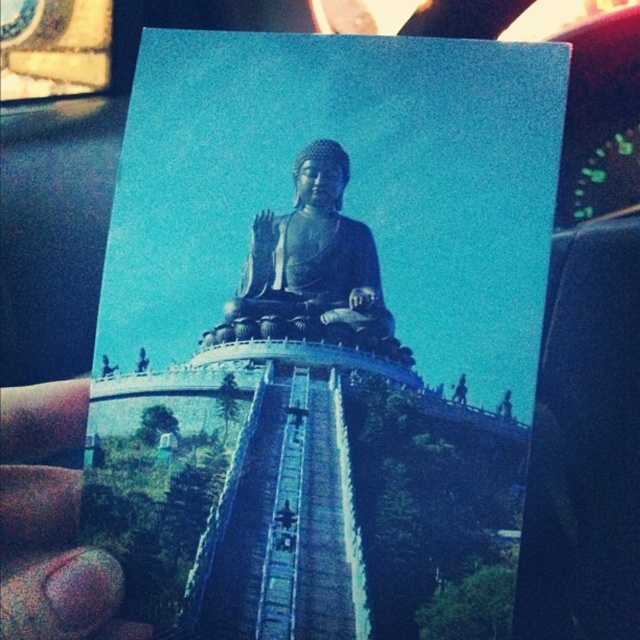
Where is `metallic statue at center`? metallic statue at center is located at coordinates (321, 330).

Find the location of a particular element. metallic statue at center is located at coordinates (321, 330).

Does metallic statue at center have a larger size compared to pink nail polish at lower left?

Yes.

Is metallic statue at center taller than pink nail polish at lower left?

Yes.

Locate an element on the screen. metallic statue at center is located at coordinates (321, 330).

Which is more to the left, pink nail polish at lower left or black polished statue at center?

pink nail polish at lower left is more to the left.

What do you see at coordinates (51, 524) in the screenshot? The height and width of the screenshot is (640, 640). I see `pink nail polish at lower left` at bounding box center [51, 524].

Is point (29, 570) positioned after point (321, 164)?

No, (29, 570) is in front of (321, 164).

Locate an element on the screen. The height and width of the screenshot is (640, 640). pink nail polish at lower left is located at coordinates (51, 524).